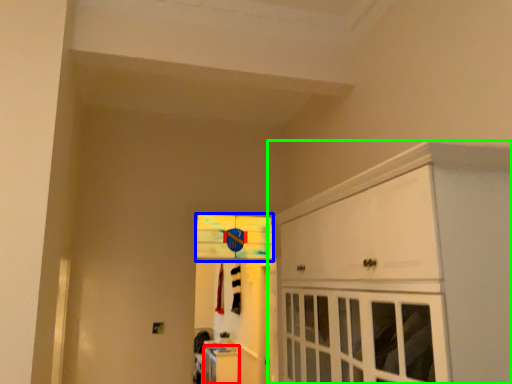
Question: Based on their relative distances, which object is nearer to cabinetry (highlighted by a red box)? Choose from window (highlighted by a blue box) and cabinetry (highlighted by a green box).

Choices:
 (A) window
 (B) cabinetry

Answer: (A)